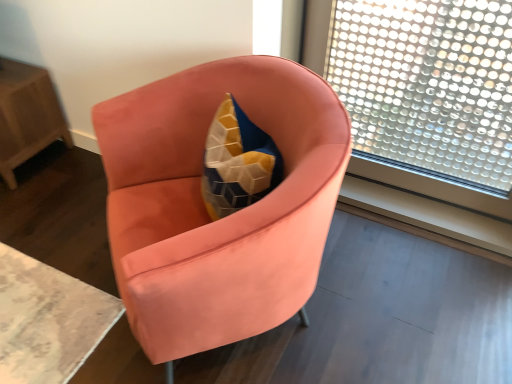
Question: Does satin coral armchair at center appear on the left side of transparent glass window at upper right?

Choices:
 (A) yes
 (B) no

Answer: (A)

Question: Can we say satin coral armchair at center lies outside transparent glass window at upper right?

Choices:
 (A) yes
 (B) no

Answer: (A)

Question: Could you tell me if satin coral armchair at center is turned towards transparent glass window at upper right?

Choices:
 (A) yes
 (B) no

Answer: (B)

Question: Can you confirm if satin coral armchair at center is taller than transparent glass window at upper right?

Choices:
 (A) no
 (B) yes

Answer: (A)

Question: Can you see satin coral armchair at center touching transparent glass window at upper right?

Choices:
 (A) no
 (B) yes

Answer: (A)

Question: Is point (261, 266) closer or farther from the camera than point (468, 185)?

Choices:
 (A) closer
 (B) farther

Answer: (A)

Question: Is satin coral armchair at center inside or outside of transparent glass window at upper right?

Choices:
 (A) outside
 (B) inside

Answer: (A)

Question: Considering the positions of satin coral armchair at center and transparent glass window at upper right in the image, is satin coral armchair at center taller or shorter than transparent glass window at upper right?

Choices:
 (A) short
 (B) tall

Answer: (A)

Question: From a real-world perspective, is satin coral armchair at center positioned above or below transparent glass window at upper right?

Choices:
 (A) below
 (B) above

Answer: (A)

Question: Do you think satin coral armchair at center is within wooden table at left, or outside of it?

Choices:
 (A) inside
 (B) outside

Answer: (B)

Question: Looking at the image, does satin coral armchair at center seem bigger or smaller compared to wooden table at left?

Choices:
 (A) big
 (B) small

Answer: (A)

Question: Considering their positions, is satin coral armchair at center located in front of or behind wooden table at left?

Choices:
 (A) behind
 (B) front

Answer: (B)

Question: Considering the relative positions of satin coral armchair at center and wooden table at left in the image provided, is satin coral armchair at center to the left or to the right of wooden table at left?

Choices:
 (A) right
 (B) left

Answer: (A)

Question: From a real-world perspective, is transparent glass window at upper right above or below wooden table at left?

Choices:
 (A) above
 (B) below

Answer: (A)

Question: Is transparent glass window at upper right spatially inside wooden table at left, or outside of it?

Choices:
 (A) outside
 (B) inside

Answer: (A)